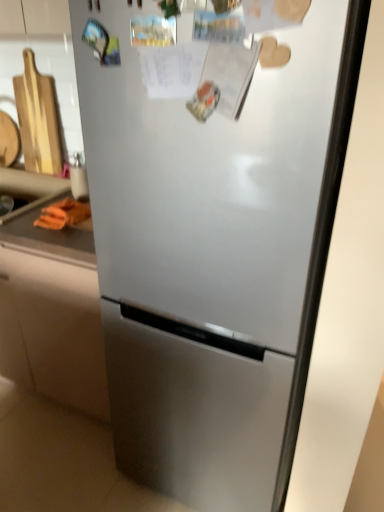
Question: Can you see orange fabric at left touching orange rubber at lower left?

Choices:
 (A) yes
 (B) no

Answer: (B)

Question: Can you confirm if orange fabric at left is bigger than orange rubber at lower left?

Choices:
 (A) no
 (B) yes

Answer: (B)

Question: Considering the relative sizes of orange fabric at left and orange rubber at lower left in the image provided, is orange fabric at left shorter than orange rubber at lower left?

Choices:
 (A) yes
 (B) no

Answer: (B)

Question: Is orange rubber at lower left at the back of orange fabric at left?

Choices:
 (A) no
 (B) yes

Answer: (B)

Question: Considering the relative sizes of orange fabric at left and orange rubber at lower left in the image provided, is orange fabric at left wider than orange rubber at lower left?

Choices:
 (A) no
 (B) yes

Answer: (B)

Question: Considering the relative sizes of orange fabric at left and orange rubber at lower left in the image provided, is orange fabric at left taller than orange rubber at lower left?

Choices:
 (A) yes
 (B) no

Answer: (A)

Question: Is orange rubber at lower left located outside orange fabric at left?

Choices:
 (A) no
 (B) yes

Answer: (B)

Question: Does orange rubber at lower left come behind orange fabric at left?

Choices:
 (A) no
 (B) yes

Answer: (B)

Question: Is orange rubber at lower left positioned with its back to orange fabric at left?

Choices:
 (A) no
 (B) yes

Answer: (A)

Question: From the image's perspective, is orange rubber at lower left above orange fabric at left?

Choices:
 (A) yes
 (B) no

Answer: (A)

Question: Is orange rubber at lower left taller than orange fabric at left?

Choices:
 (A) yes
 (B) no

Answer: (A)

Question: Considering the relative sizes of orange rubber at lower left and orange fabric at left in the image provided, is orange rubber at lower left wider than orange fabric at left?

Choices:
 (A) no
 (B) yes

Answer: (B)

Question: From a real-world perspective, is orange fabric at left positioned over orange fabric at left based on gravity?

Choices:
 (A) yes
 (B) no

Answer: (A)